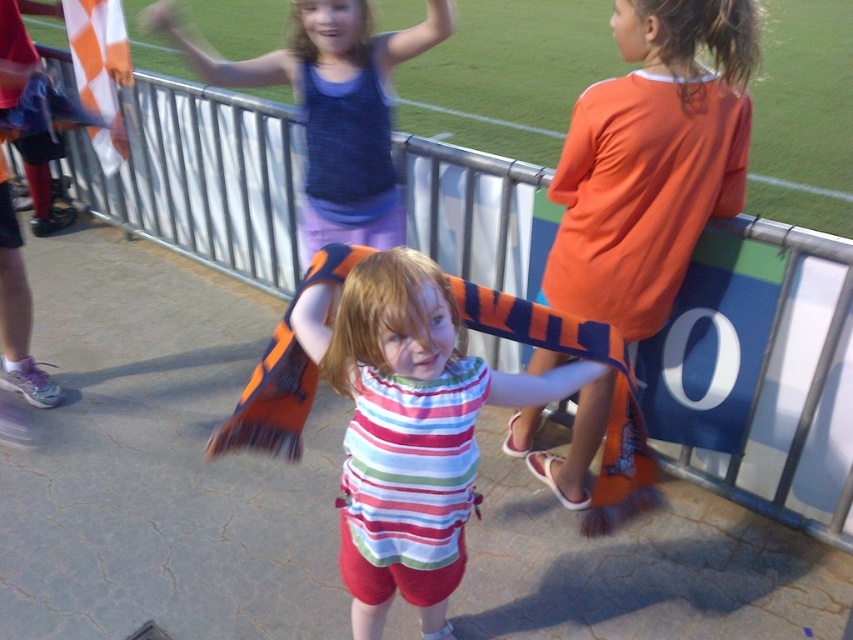
You are a photographer at the soccer field and you need to take a photo of the striped cotton shirt at center and the matte blue tank top at upper center. Which one is on the right side when looking at the photo?

The striped cotton shirt at center is positioned on the right side of matte blue tank top at upper center, so in the photo, the striped cotton shirt at center will be on the right side.

You are a photographer at the soccer event. You need to capture a photo where both the striped cotton shirt at center and the matte blue tank top at upper center are visible. Which clothing item should you focus on first to ensure both are in frame?

The striped cotton shirt at center is taller than the matte blue tank top at upper center, so you should focus on the striped cotton shirt at center first to ensure both are in frame.

You are a photographer trying to capture the soccer game. You notice two points in the image at coordinates point (612, 113) and point (328, 228). Which point is closer to your camera?

Point (612, 113) is closer to the camera than point (328, 228).